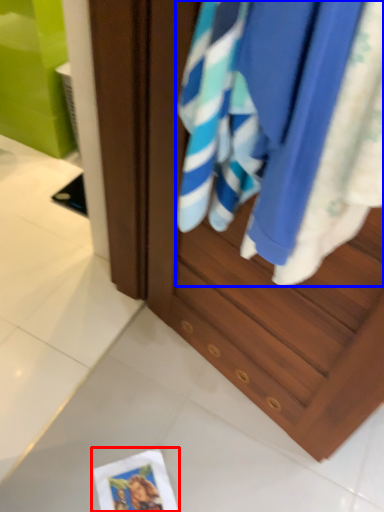
Question: Which object is closer to the camera taking this photo, postcard (highlighted by a red box) or beach towel (highlighted by a blue box)?

Choices:
 (A) postcard
 (B) beach towel

Answer: (B)